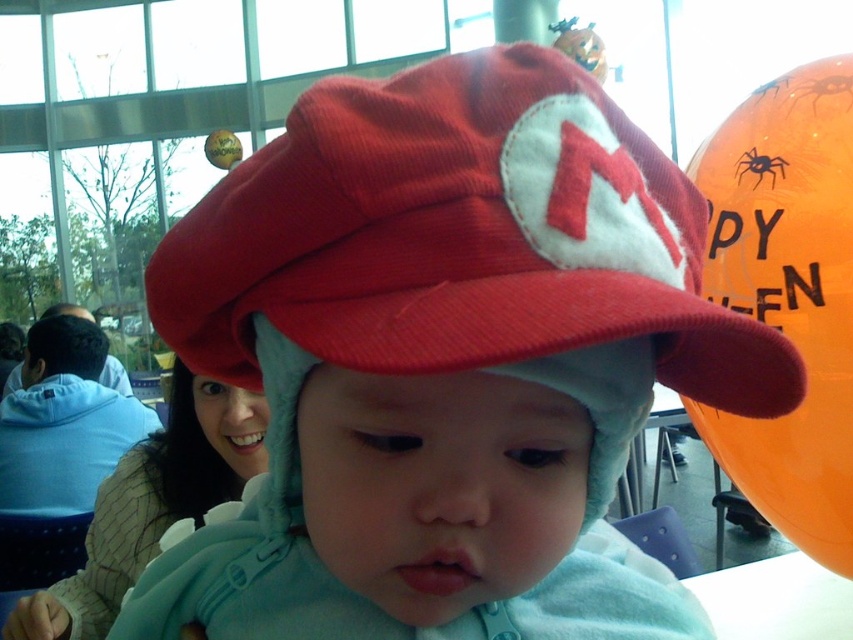
You are at a Halloween party and see the red corduroy hat at center and the black matte spider at upper right. Which object is located to the left of the other?

The red corduroy hat at center is positioned on the left side of black matte spider at upper right.

You are a photographer trying to capture the red corduroy hat at center and the orange glossy balloon at upper right in a single shot. Based on their positions, which object will appear larger in the photo?

The red corduroy hat at center will appear larger in the photo because it is closer to the viewer than the orange glossy balloon at upper right.